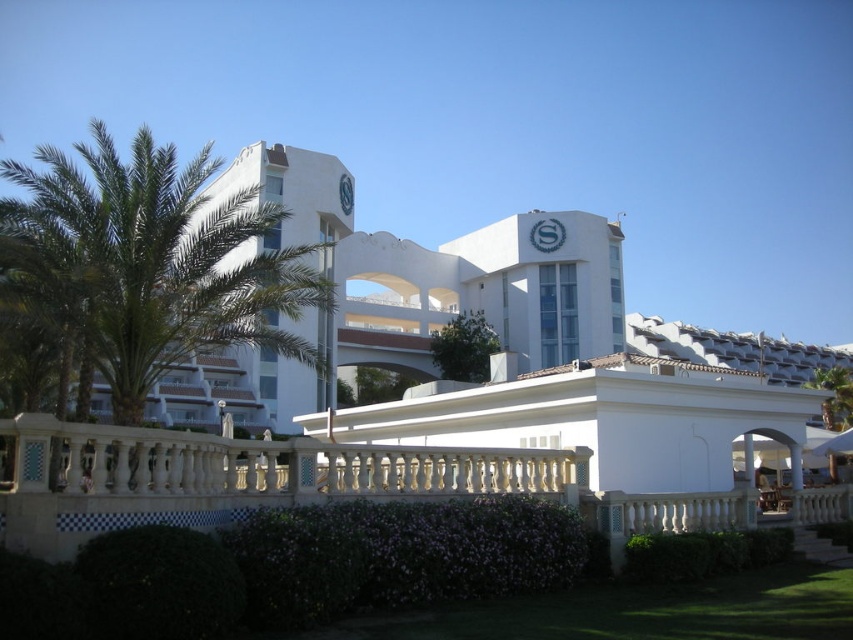
You are standing at the entrance of the modern architectural structure and want to take a photo of two specific points marked in the scene. The first point is at coordinates point [123,310] and the second is at point [625,554]. Which point will appear larger in your photo?

Point [123,310] is closer to the viewer than point [625,554], so it will appear larger in the photo.

You are standing at the entrance of the modern architectural structure and want to walk towards the two points marked in the image. Which point, point (289, 611) or point (627, 573), will you reach first?

Point (289, 611) is closer to the viewer than point (627, 573), so you will reach point (289, 611) first.

You are standing at the entrance of the modern architectural structure and want to take a photo of the green leafy palm tree at left. According to the coordinates provided, where exactly should you position yourself to capture the palm tree in your frame?

The green leafy palm tree at left is located at coordinates point (154, 260), so you should position yourself at the entrance and aim your camera towards that coordinate point to capture it in your frame.